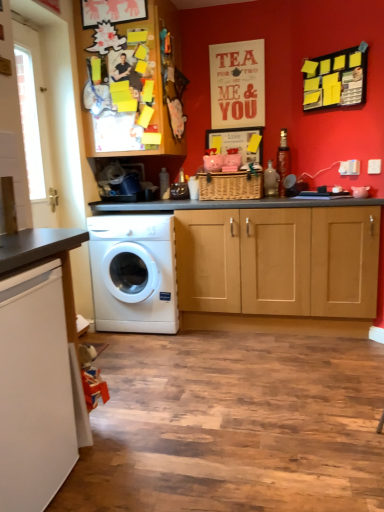
What is the approximate width of yellow sticky notes on black board at upper right?

yellow sticky notes on black board at upper right is 6.55 centimeters wide.

This screenshot has height=512, width=384. Describe the element at coordinates (133, 273) in the screenshot. I see `white glossy washing machine at center` at that location.

At what (x,y) coordinates should I click in order to perform the action: click on wooden cabinet at upper left. Please return your answer as a coordinate pair (x, y). The height and width of the screenshot is (512, 384). Looking at the image, I should click on (127, 75).

Does white glossy countertop at lower left have a greater height compared to yellow sticky notes on black board at upper right?

Yes, white glossy countertop at lower left is taller than yellow sticky notes on black board at upper right.

Is white glossy countertop at lower left bigger or smaller than yellow sticky notes on black board at upper right?

Considering their sizes, white glossy countertop at lower left takes up more space than yellow sticky notes on black board at upper right.

Find the location of a particular element. This screenshot has height=512, width=384. countertop lying in front of the yellow sticky notes on black board at upper right is located at coordinates (36, 366).

Is white glossy countertop at lower left placed right next to yellow sticky notes on black board at upper right?

No, white glossy countertop at lower left is not making contact with yellow sticky notes on black board at upper right.

Would you say white glossy washing machine at center is to the left or to the right of wooden cabinet at upper left in the picture?

white glossy washing machine at center is to the right of wooden cabinet at upper left.

Considering the sizes of objects white glossy washing machine at center and wooden cabinet at upper left in the image provided, who is bigger, white glossy washing machine at center or wooden cabinet at upper left?

wooden cabinet at upper left is bigger.

Are white glossy washing machine at center and wooden cabinet at upper left beside each other?

No, white glossy washing machine at center is not with wooden cabinet at upper left.

Is white glossy washing machine at center surrounding wooden cabinet at upper left?

Definitely not — wooden cabinet at upper left is not inside white glossy washing machine at center.

Between yellow sticky notes on black board at upper right and white glossy countertop at lower left, which one has larger width?

With larger width is white glossy countertop at lower left.

Is yellow sticky notes on black board at upper right directly adjacent to white glossy countertop at lower left?

yellow sticky notes on black board at upper right and white glossy countertop at lower left are clearly separated.

Considering the sizes of yellow sticky notes on black board at upper right and white glossy countertop at lower left in the image, is yellow sticky notes on black board at upper right bigger or smaller than white glossy countertop at lower left?

Clearly, yellow sticky notes on black board at upper right is smaller in size than white glossy countertop at lower left.

Is wooden cabinet at upper left located outside yellow sticky notes on black board at upper right?

wooden cabinet at upper left is positioned outside yellow sticky notes on black board at upper right.

Is wooden cabinet at upper left next to yellow sticky notes on black board at upper right?

They are not placed beside each other.

Which is closer, (114, 119) or (354, 83)?

Point (114, 119).

Could you tell me if white glossy countertop at lower left is facing white glossy washing machine at center?

No.

Is white glossy countertop at lower left located outside white glossy washing machine at center?

white glossy countertop at lower left lies outside white glossy washing machine at center's area.

Is white glossy countertop at lower left to the left or to the right of white glossy washing machine at center in the image?

white glossy countertop at lower left is positioned on white glossy washing machine at center's left side.

Is white glossy countertop at lower left far away from white glossy washing machine at center?

Indeed, white glossy countertop at lower left is not near white glossy washing machine at center.

Is white glossy countertop at lower left in front of or behind wooden cabinet at upper left in the image?

Visually, white glossy countertop at lower left is located in front of wooden cabinet at upper left.

From the image's perspective, is white glossy countertop at lower left located above wooden cabinet at upper left?

No, from the image's perspective, white glossy countertop at lower left is not above wooden cabinet at upper left.

Which is more to the right, white glossy countertop at lower left or wooden cabinet at upper left?

Positioned to the right is wooden cabinet at upper left.

Is yellow sticky notes on black board at upper right with white glossy washing machine at center?

No.

Does yellow sticky notes on black board at upper right have a larger size compared to white glossy washing machine at center?

No.

Can you tell me how much yellow sticky notes on black board at upper right and white glossy washing machine at center differ in facing direction?

The facing directions of yellow sticky notes on black board at upper right and white glossy washing machine at center are 44.6 degrees apart.

Is yellow sticky notes on black board at upper right taller or shorter than white glossy washing machine at center?

In the image, yellow sticky notes on black board at upper right appears to be shorter than white glossy washing machine at center.

Image resolution: width=384 pixels, height=512 pixels. I want to click on countertop that is below the yellow sticky notes on black board at upper right (from the image's perspective), so click(36, 366).

The height and width of the screenshot is (512, 384). I want to click on washing machine located behind the wooden cabinet at upper left, so [133, 273].

Based on the photo, considering their positions, is white glossy countertop at lower left positioned further to white glossy washing machine at center than wooden cabinet at upper left?

Based on the image, white glossy countertop at lower left appears to be further to white glossy washing machine at center.

Which object lies nearer to the anchor point yellow sticky notes on black board at upper right, white glossy countertop at lower left or wooden cabinet at upper left?

The object closer to yellow sticky notes on black board at upper right is wooden cabinet at upper left.

Based on their spatial positions, is yellow sticky notes on black board at upper right or wooden cabinet at upper left further from white glossy washing machine at center?

yellow sticky notes on black board at upper right is positioned further to the anchor white glossy washing machine at center.

Estimate the real-world distances between objects in this image. Which object is closer to wooden cabinet at upper left, white glossy washing machine at center or white glossy countertop at lower left?

white glossy washing machine at center lies closer to wooden cabinet at upper left than the other object.

Looking at this image, when comparing their distances from wooden cabinet at upper left, does yellow sticky notes on black board at upper right or white glossy washing machine at center seem further?

yellow sticky notes on black board at upper right lies further to wooden cabinet at upper left than the other object.

From the image, which object appears to be farther from yellow sticky notes on black board at upper right, wooden cabinet at upper left or white glossy countertop at lower left?

Among the two, white glossy countertop at lower left is located further to yellow sticky notes on black board at upper right.

Considering their positions, is yellow sticky notes on black board at upper right positioned closer to white glossy countertop at lower left than wooden cabinet at upper left?

wooden cabinet at upper left is positioned closer to the anchor white glossy countertop at lower left.

Based on their spatial positions, is yellow sticky notes on black board at upper right or white glossy countertop at lower left further from wooden cabinet at upper left?

Based on the image, white glossy countertop at lower left appears to be further to wooden cabinet at upper left.

Where is `bulletin board positioned between white glossy countertop at lower left and white glossy washing machine at center from near to far`? The height and width of the screenshot is (512, 384). bulletin board positioned between white glossy countertop at lower left and white glossy washing machine at center from near to far is located at coordinates (335, 79).

The height and width of the screenshot is (512, 384). I want to click on washing machine that lies between wooden cabinet at upper left and white glossy countertop at lower left from top to bottom, so click(133, 273).

The height and width of the screenshot is (512, 384). What are the coordinates of `bulletin board between wooden cabinet at upper left and white glossy countertop at lower left in the up-down direction` in the screenshot? It's located at pos(335,79).

At what (x,y) coordinates should I click in order to perform the action: click on bulletin board between wooden cabinet at upper left and white glossy washing machine at center vertically. Please return your answer as a coordinate pair (x, y). The image size is (384, 512). Looking at the image, I should click on (335, 79).